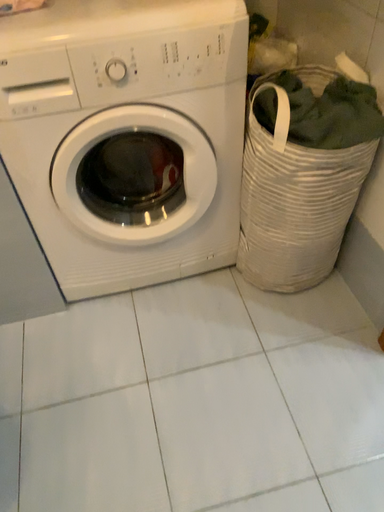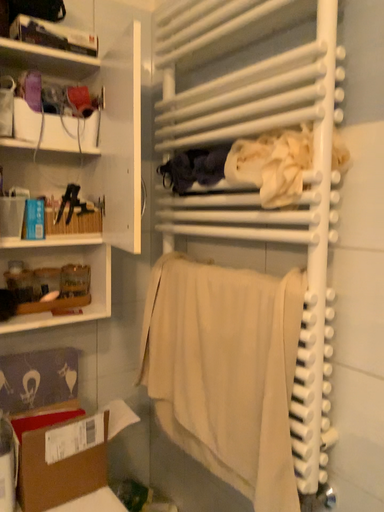
Question: Which way did the camera rotate in the video?

Choices:
 (A) rotated upward
 (B) rotated downward

Answer: (A)